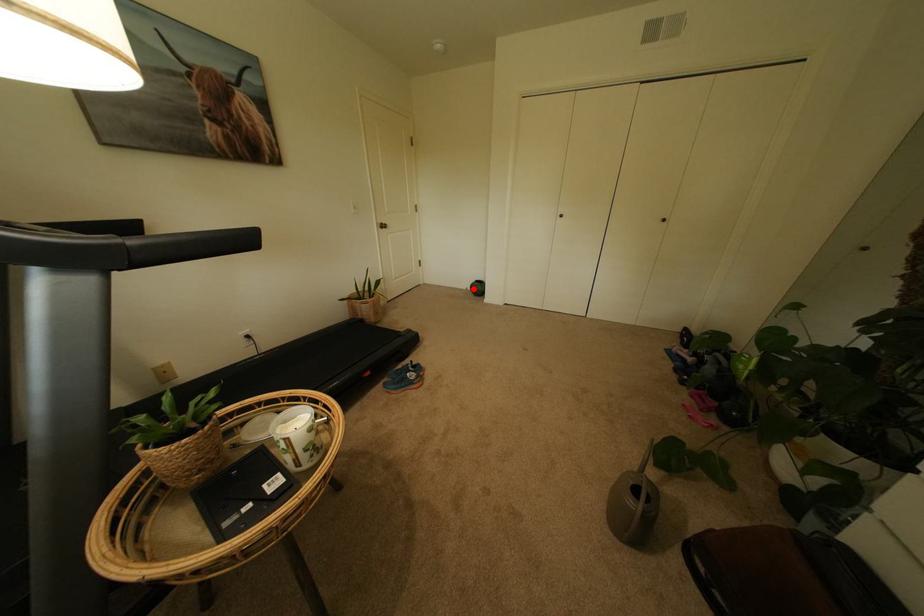
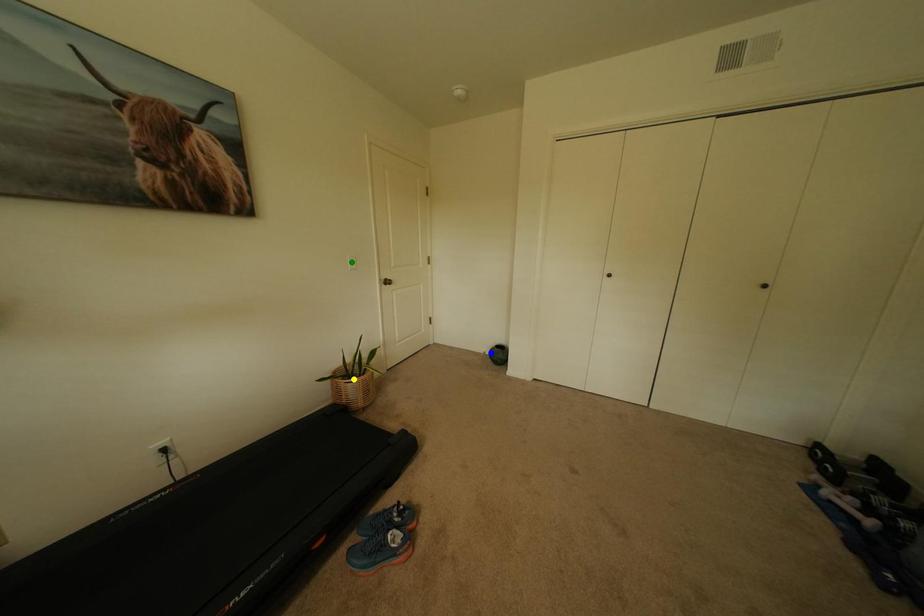
Question: I am providing you with two images of the same scene from different viewpoints. A red point is marked on the first image. You are given multiple points on the second image. Which spot in image 2 lines up with the point in image 1?

Choices:
 (A) blue point
 (B) green point
 (C) yellow point

Answer: (A)